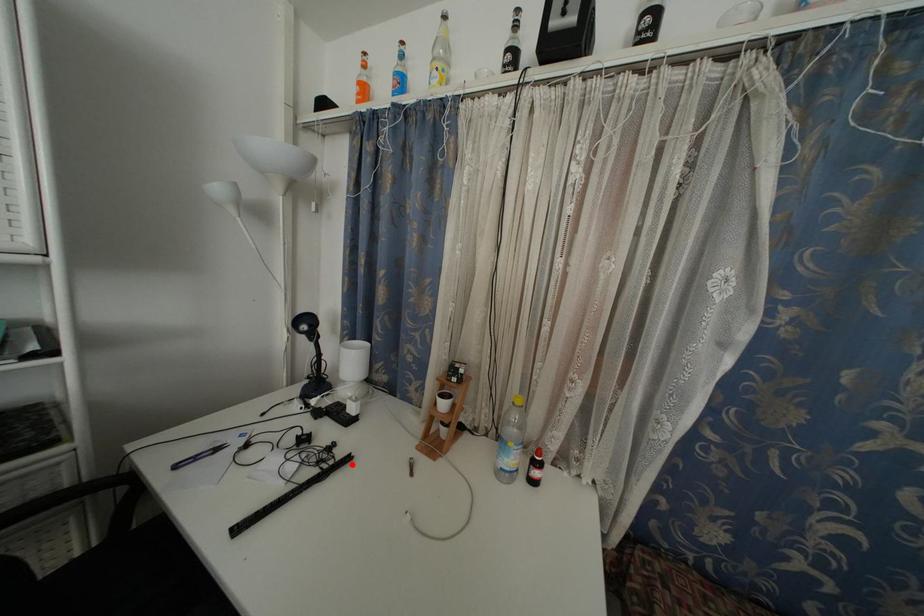
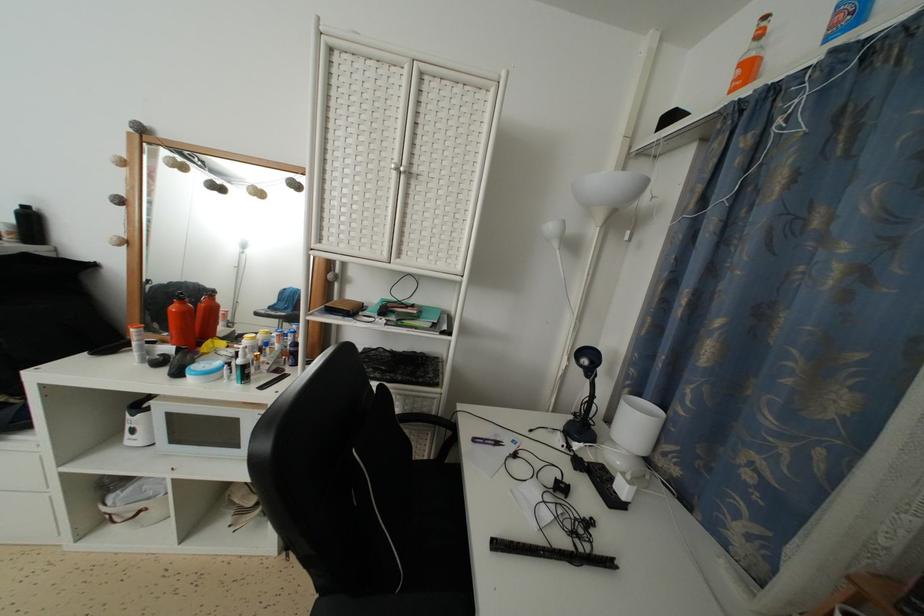
Find the pixel in the second image that matches the highlighted location in the first image.

(614, 569)